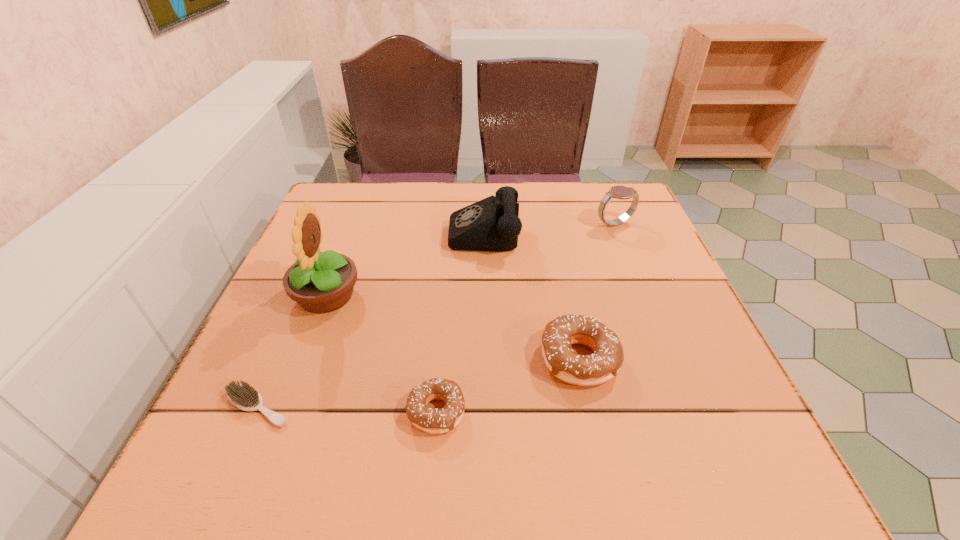
Locate an element on the screen. the shorter doughnut is located at coordinates (431, 420).

Find the location of a particular element. the fifth tallest object is located at coordinates (431, 420).

Locate an element on the screen. the right doughnut is located at coordinates (563, 362).

You are a GUI agent. You are given a task and a screenshot of the screen. Output one action in this format:
    pyautogui.click(x=<x>, y=<y>)
    Task: Click on the taller doughnut
    Image resolution: width=960 pixels, height=540 pixels.
    Given the screenshot: What is the action you would take?
    pyautogui.click(x=563, y=362)

Identify the location of the second tallest object. [x=492, y=224].

Locate an element on the screen. The image size is (960, 540). the fourth nearest object is located at coordinates (320, 282).

Image resolution: width=960 pixels, height=540 pixels. Find the location of `the tallest object`. the tallest object is located at coordinates [x=320, y=282].

At what (x,y) coordinates should I click in order to perform the action: click on the rightmost object. Please return your answer as a coordinate pair (x, y). The width and height of the screenshot is (960, 540). Looking at the image, I should click on (620, 192).

Where is `watch`? The image size is (960, 540). watch is located at coordinates (620, 192).

You are a GUI agent. You are given a task and a screenshot of the screen. Output one action in this format:
    pyautogui.click(x=<x>, y=<y>)
    Task: Click on the scrubbing brush
    The height and width of the screenshot is (540, 960).
    Given the screenshot: What is the action you would take?
    pyautogui.click(x=243, y=396)